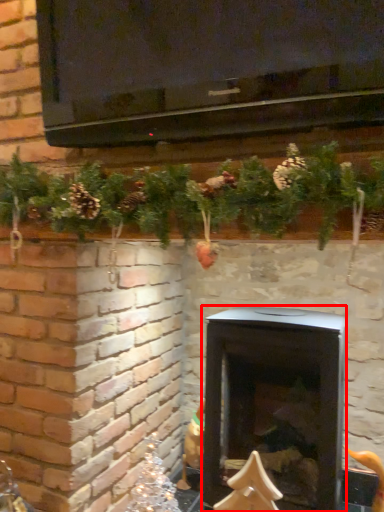
Question: Considering the relative positions of wood burning stove (annotated by the red box) and christmas decoration in the image provided, where is wood burning stove (annotated by the red box) located with respect to the staircase?

Choices:
 (A) left
 (B) right

Answer: (B)